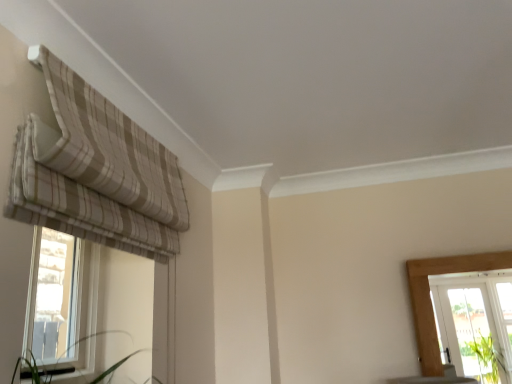
Locate an element on the screen. The image size is (512, 384). beige striped fabric at upper left is located at coordinates (97, 173).

The width and height of the screenshot is (512, 384). Describe the element at coordinates (97, 173) in the screenshot. I see `beige striped fabric at upper left` at that location.

In order to face clear glass window at left, should I rotate leftwards or rightwards?

Rotate left and turn 24.472 degrees.

This screenshot has width=512, height=384. What do you see at coordinates (85, 305) in the screenshot?
I see `clear glass window at left` at bounding box center [85, 305].

Where is `clear glass window at left`? The height and width of the screenshot is (384, 512). clear glass window at left is located at coordinates (85, 305).

Identify the location of beige striped fabric at upper left. The height and width of the screenshot is (384, 512). (97, 173).

Does beige striped fabric at upper left appear on the left side of clear glass window at left?

In fact, beige striped fabric at upper left is to the right of clear glass window at left.

Considering their positions, is beige striped fabric at upper left located in front of or behind clear glass window at left?

Clearly, beige striped fabric at upper left is in front of clear glass window at left.

Is point (17, 187) closer to viewer compared to point (45, 302)?

Yes, it is.

Consider the image. From the image's perspective, between beige striped fabric at upper left and clear glass window at left, which one is located above?

From the image's view, beige striped fabric at upper left is above.

From a real-world perspective, relative to clear glass window at left, is beige striped fabric at upper left vertically above or below?

In terms of real-world spatial position, beige striped fabric at upper left is above clear glass window at left.

Which of these two, beige striped fabric at upper left or clear glass window at left, is wider?

beige striped fabric at upper left is wider.

Between beige striped fabric at upper left and clear glass window at left, which one has less height?

Standing shorter between the two is beige striped fabric at upper left.

Between beige striped fabric at upper left and clear glass window at left, which one has smaller size?

clear glass window at left.

Is beige striped fabric at upper left located outside clear glass window at left?

That's correct, beige striped fabric at upper left is outside of clear glass window at left.

Is beige striped fabric at upper left placed right next to clear glass window at left?

beige striped fabric at upper left and clear glass window at left are clearly separated.

Is beige striped fabric at upper left positioned with its back to clear glass window at left?

No, beige striped fabric at upper left's orientation is not away from clear glass window at left.

Image resolution: width=512 pixels, height=384 pixels. In order to click on window that appears below the beige striped fabric at upper left (from the image's perspective) in this screenshot , I will do `click(85, 305)`.

Between clear glass window at left and beige striped fabric at upper left, which one appears on the left side from the viewer's perspective?

clear glass window at left is more to the left.

Between clear glass window at left and beige striped fabric at upper left, which one is positioned behind?

clear glass window at left is more distant.

Which is farther, (53, 297) or (94, 133)?

The point (53, 297) is farther.

From the image's perspective, between clear glass window at left and beige striped fabric at upper left, which one is located above?

beige striped fabric at upper left.

From a real-world perspective, between clear glass window at left and beige striped fabric at upper left, who is vertically lower?

In real-world perspective, clear glass window at left is lower.

Considering the sizes of clear glass window at left and beige striped fabric at upper left in the image, is clear glass window at left wider or thinner than beige striped fabric at upper left?

In the image, clear glass window at left appears to be more narrow than beige striped fabric at upper left.

Considering the relative sizes of clear glass window at left and beige striped fabric at upper left in the image provided, is clear glass window at left taller than beige striped fabric at upper left?

Indeed, clear glass window at left has a greater height compared to beige striped fabric at upper left.

Considering the sizes of objects clear glass window at left and beige striped fabric at upper left in the image provided, who is smaller, clear glass window at left or beige striped fabric at upper left?

clear glass window at left.

From the picture: Is clear glass window at left situated inside beige striped fabric at upper left or outside?

clear glass window at left is spatially situated outside beige striped fabric at upper left.

Would you say clear glass window at left is a long distance from beige striped fabric at upper left?

No, clear glass window at left is not far from beige striped fabric at upper left.

Is clear glass window at left oriented away from beige striped fabric at upper left?

No, clear glass window at left is not facing away from beige striped fabric at upper left.

How many degrees apart are the facing directions of clear glass window at left and beige striped fabric at upper left?

There is a 0.0118-degree angle between the facing directions of clear glass window at left and beige striped fabric at upper left.

Find the location of a particular element. window to the left of beige striped fabric at upper left is located at coordinates (85, 305).

The height and width of the screenshot is (384, 512). I want to click on curtain that is above the clear glass window at left (from the image's perspective), so click(97, 173).

Where is `curtain in front of the clear glass window at left`? This screenshot has height=384, width=512. curtain in front of the clear glass window at left is located at coordinates (97, 173).